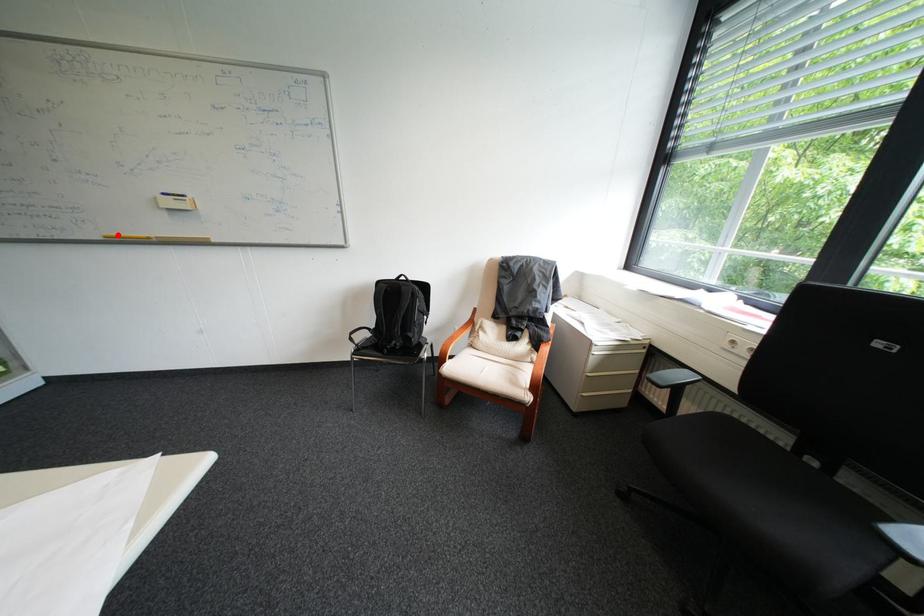
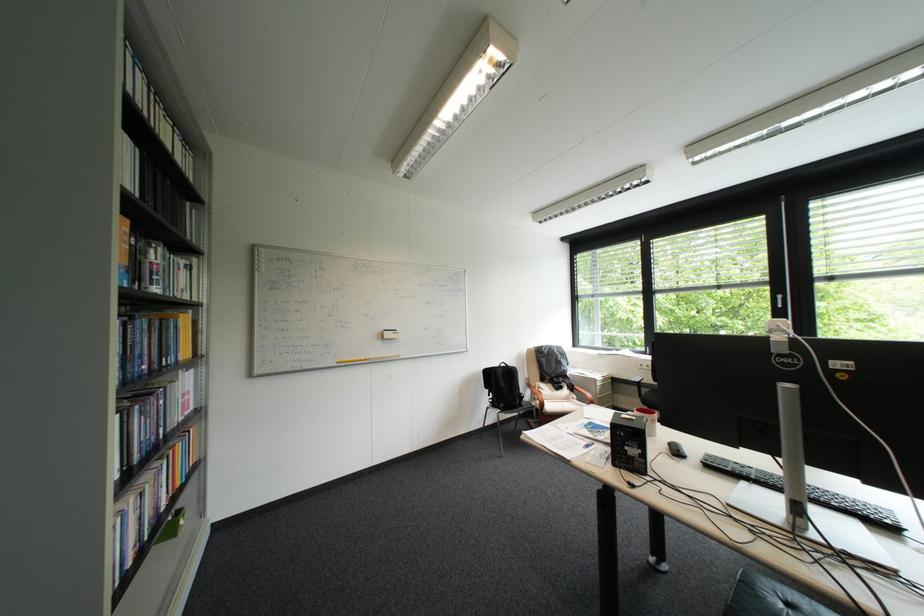
Locate, in the second image, the point that corresponds to the highlighted location in the first image.

(350, 361)